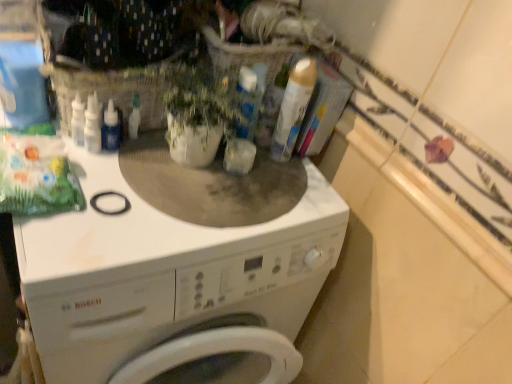
Find the location of a particular element. The width and height of the screenshot is (512, 384). free space in front of gold metallic can at upper center is located at coordinates (263, 198).